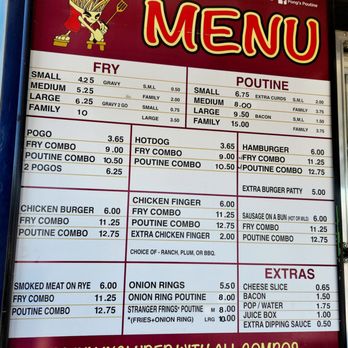
Image resolution: width=348 pixels, height=348 pixels. I want to click on stand, so click(x=101, y=45), click(x=60, y=43).